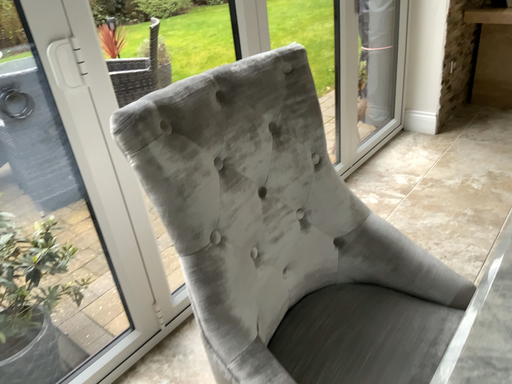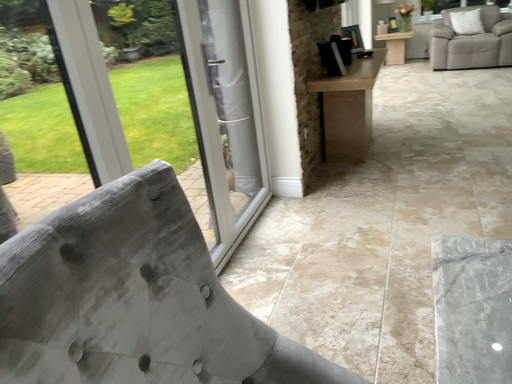
Question: Which way did the camera rotate in the video?

Choices:
 (A) rotated upward
 (B) rotated downward

Answer: (A)